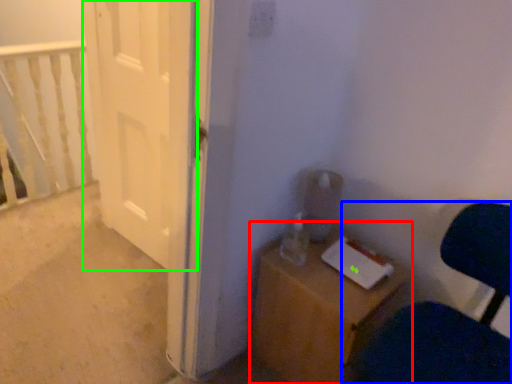
Question: Considering the real-world distances, which object is farthest from furniture (highlighted by a red box)? chair (highlighted by a blue box) or door (highlighted by a green box)?

Choices:
 (A) chair
 (B) door

Answer: (B)